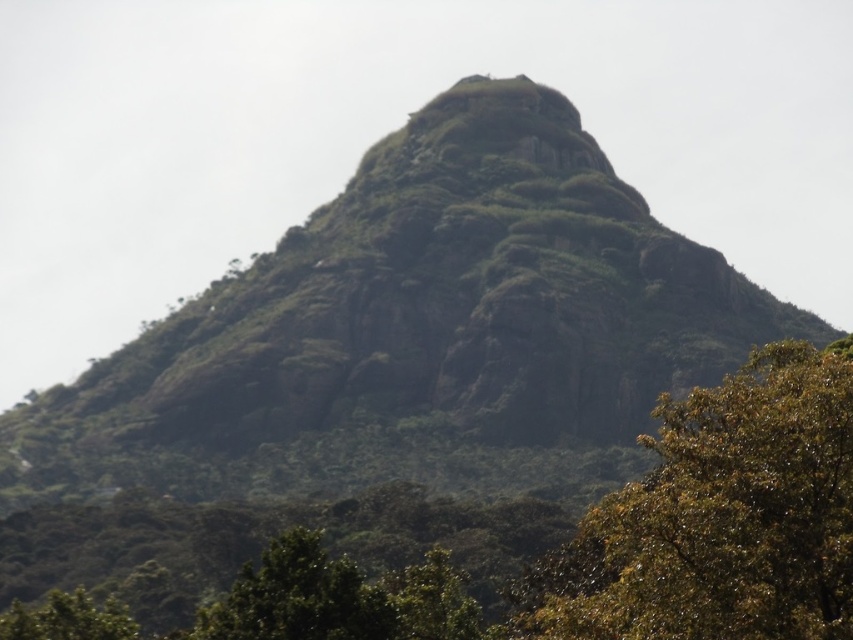
Question: Does green leafy tree at center have a larger size compared to green leafy tree at lower left?

Choices:
 (A) yes
 (B) no

Answer: (A)

Question: Which of the following is the closest to the observer?

Choices:
 (A) (73, 630)
 (B) (775, 488)

Answer: (B)

Question: Does green leafy tree at center have a larger size compared to green leafy tree at lower left?

Choices:
 (A) yes
 (B) no

Answer: (A)

Question: Among these objects, which one is farthest from the camera?

Choices:
 (A) green leafy tree at center
 (B) green leafy tree at lower left

Answer: (B)

Question: Where is green leafy tree at center located in relation to green leafy tree at lower left in the image?

Choices:
 (A) below
 (B) above

Answer: (B)